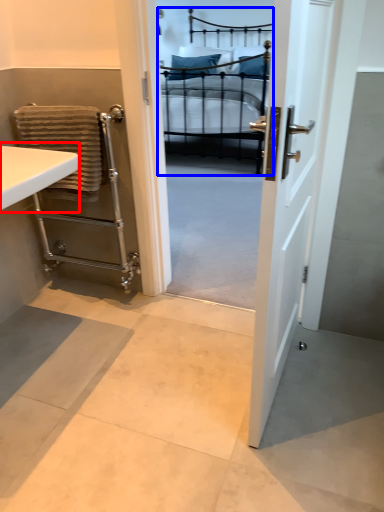
Question: Which of the following is the closest to the observer, sink (highlighted by a red box) or bed (highlighted by a blue box)?

Choices:
 (A) sink
 (B) bed

Answer: (A)